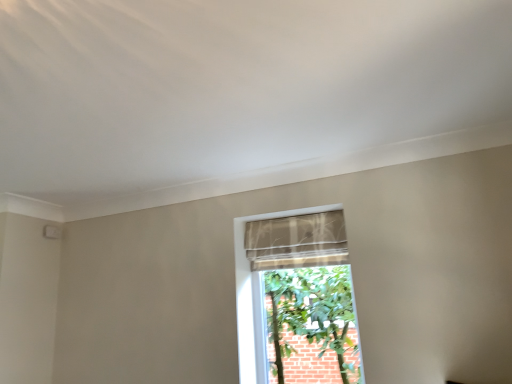
Locate an element on the screen. This screenshot has height=384, width=512. beige textured fabric at center is located at coordinates (296, 300).

This screenshot has height=384, width=512. Describe the element at coordinates (296, 300) in the screenshot. I see `beige textured fabric at center` at that location.

This screenshot has height=384, width=512. What do you see at coordinates (297, 241) in the screenshot?
I see `sheer fabric curtain at center` at bounding box center [297, 241].

What are the coordinates of `sheer fabric curtain at center` in the screenshot? It's located at (297, 241).

Locate an element on the screen. The height and width of the screenshot is (384, 512). beige textured fabric at center is located at coordinates (296, 300).

Is beige textured fabric at center to the left of sheer fabric curtain at center from the viewer's perspective?

No, beige textured fabric at center is not to the left of sheer fabric curtain at center.

Which object is further away from the camera, beige textured fabric at center or sheer fabric curtain at center?

sheer fabric curtain at center is behind.

Which is in front, point (291, 319) or point (321, 223)?

The point (321, 223) is closer.

From the image's perspective, between beige textured fabric at center and sheer fabric curtain at center, who is located below?

beige textured fabric at center is shown below in the image.

From a real-world perspective, which object stands above the other?

sheer fabric curtain at center, from a real-world perspective.

Which object is wider, beige textured fabric at center or sheer fabric curtain at center?

sheer fabric curtain at center is wider.

Which of these two, beige textured fabric at center or sheer fabric curtain at center, stands taller?

Standing taller between the two is beige textured fabric at center.

Is beige textured fabric at center bigger or smaller than sheer fabric curtain at center?

In the image, beige textured fabric at center appears to be larger than sheer fabric curtain at center.

Is beige textured fabric at center surrounding sheer fabric curtain at center?

Yes, beige textured fabric at center is surrounding sheer fabric curtain at center.

Consider the image. Is beige textured fabric at center far from sheer fabric curtain at center?

No, beige textured fabric at center is in close proximity to sheer fabric curtain at center.

Is beige textured fabric at center positioned with its back to sheer fabric curtain at center?

Yes, beige textured fabric at center's orientation is away from sheer fabric curtain at center.

Where is `window that appears below the sheer fabric curtain at center (from the image's perspective)`? window that appears below the sheer fabric curtain at center (from the image's perspective) is located at coordinates (296, 300).

Between sheer fabric curtain at center and beige textured fabric at center, which one appears on the left side from the viewer's perspective?

sheer fabric curtain at center is more to the left.

Which object is more forward, sheer fabric curtain at center or beige textured fabric at center?

beige textured fabric at center.

Which is closer, (262,242) or (239,316)?

The point (239,316) is more forward.

From the image's perspective, is sheer fabric curtain at center under beige textured fabric at center?

Incorrect, from the image's perspective, sheer fabric curtain at center is higher than beige textured fabric at center.

From a real-world perspective, is sheer fabric curtain at center located beneath beige textured fabric at center?

No, from a real-world perspective, sheer fabric curtain at center is not below beige textured fabric at center.

Considering the relative sizes of sheer fabric curtain at center and beige textured fabric at center in the image provided, is sheer fabric curtain at center thinner than beige textured fabric at center?

In fact, sheer fabric curtain at center might be wider than beige textured fabric at center.

In the scene shown: Does sheer fabric curtain at center have a greater height compared to beige textured fabric at center?

Incorrect, the height of sheer fabric curtain at center is not larger of that of beige textured fabric at center.

Is sheer fabric curtain at center bigger or smaller than beige textured fabric at center?

Clearly, sheer fabric curtain at center is smaller in size than beige textured fabric at center.

Can we say sheer fabric curtain at center lies outside beige textured fabric at center?

No, sheer fabric curtain at center is inside beige textured fabric at center's boundary.

Are sheer fabric curtain at center and beige textured fabric at center making contact?

No, sheer fabric curtain at center is not in contact with beige textured fabric at center.

Is sheer fabric curtain at center looking in the opposite direction of beige textured fabric at center?

Yes, sheer fabric curtain at center is positioned with its back facing beige textured fabric at center.

In the scene shown: How many degrees apart are the facing directions of sheer fabric curtain at center and beige textured fabric at center?

0.00381 degrees.

Find the location of `window beneath the sheer fabric curtain at center (from a real-world perspective)`. window beneath the sheer fabric curtain at center (from a real-world perspective) is located at coordinates pos(296,300).

In order to click on window on the right of sheer fabric curtain at center in this screenshot , I will do `click(296, 300)`.

The width and height of the screenshot is (512, 384). In order to click on curtain behind the beige textured fabric at center in this screenshot , I will do `click(297, 241)`.